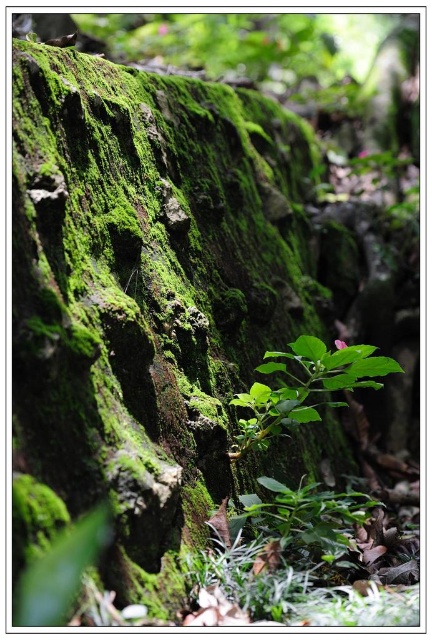
Can you confirm if green leafy plant at center is positioned above green leafy plant at lower center?

Correct, green leafy plant at center is located above green leafy plant at lower center.

Between point (305, 376) and point (285, 544), which one is positioned behind?

Point (305, 376)

Find the location of `green leafy plant at center`. green leafy plant at center is located at coordinates (304, 387).